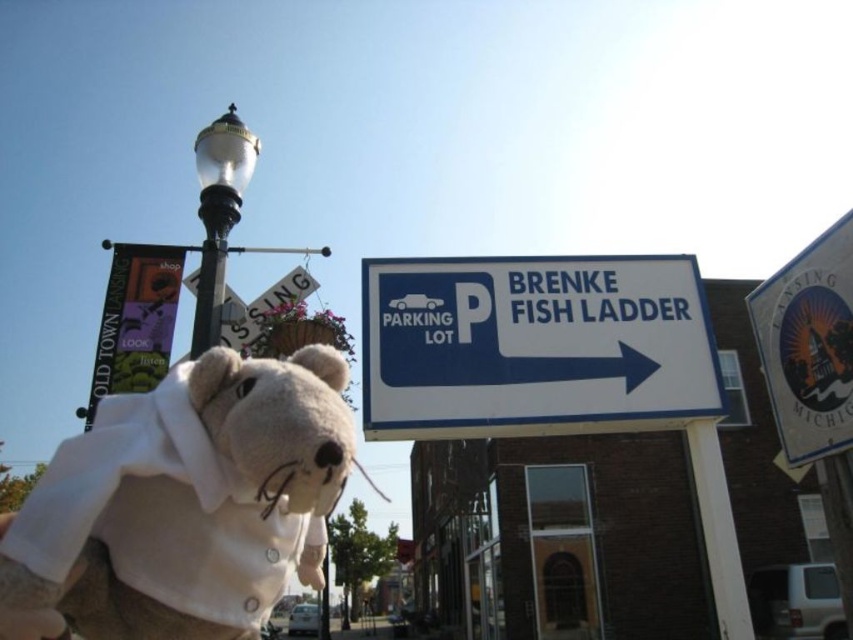
You are standing at the center of the street and see the fluffy beige teddy bear at lower left. If you want to move towards the teddy bear, which direction should you walk?

Since the fluffy beige teddy bear at lower left is located at point (183, 502), you should walk towards the lower left direction to reach it.

Consider the image. You are a delivery person holding a package and need to place it on the ground near the fluffy beige teddy bear at lower left. However, there is a white plastic sign at upper right nearby. Which object is wider so you can ensure the package won not hit the narrower one when placing it?

The white plastic sign at upper right is wider than the fluffy beige teddy bear at lower left, so you should place the package near the teddy bear to avoid hitting the wider sign.

You are a delivery person holding a package and need to decide whether to place it on the fluffy beige teddy bear at lower left or the blue plastic sign at upper right. Which object can safely hold the package without falling over?

The fluffy beige teddy bear at lower left is larger in size than the blue plastic sign at upper right, so it is more stable and can safely hold the package without falling over.